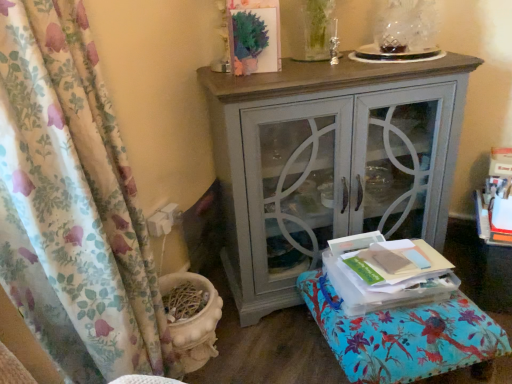
Question: Can you confirm if matte gray cabinet at center is positioned to the right of floral fabric ottoman at lower right?

Choices:
 (A) yes
 (B) no

Answer: (B)

Question: Is matte gray cabinet at center positioned far away from floral fabric ottoman at lower right?

Choices:
 (A) no
 (B) yes

Answer: (A)

Question: Can you confirm if matte gray cabinet at center is wider than floral fabric ottoman at lower right?

Choices:
 (A) no
 (B) yes

Answer: (A)

Question: Does matte gray cabinet at center have a smaller size compared to floral fabric ottoman at lower right?

Choices:
 (A) yes
 (B) no

Answer: (B)

Question: Is matte gray cabinet at center taller than floral fabric ottoman at lower right?

Choices:
 (A) no
 (B) yes

Answer: (B)

Question: From a real-world perspective, does matte gray cabinet at center sit lower than floral fabric ottoman at lower right?

Choices:
 (A) no
 (B) yes

Answer: (A)

Question: From the image's perspective, does floral fabric curtain at left appear higher than floral fabric ottoman at lower right?

Choices:
 (A) yes
 (B) no

Answer: (A)

Question: From a real-world perspective, does floral fabric curtain at left sit lower than floral fabric ottoman at lower right?

Choices:
 (A) no
 (B) yes

Answer: (A)

Question: Is floral fabric ottoman at lower right at the back of floral fabric curtain at left?

Choices:
 (A) no
 (B) yes

Answer: (A)

Question: Is floral fabric curtain at left closer to the viewer compared to floral fabric ottoman at lower right?

Choices:
 (A) no
 (B) yes

Answer: (B)

Question: Does floral fabric curtain at left appear on the left side of floral fabric ottoman at lower right?

Choices:
 (A) no
 (B) yes

Answer: (B)

Question: Is floral fabric curtain at left behind floral fabric ottoman at lower right?

Choices:
 (A) no
 (B) yes

Answer: (A)

Question: Can floral fabric curtain at left be found inside matte gray cabinet at center?

Choices:
 (A) yes
 (B) no

Answer: (B)